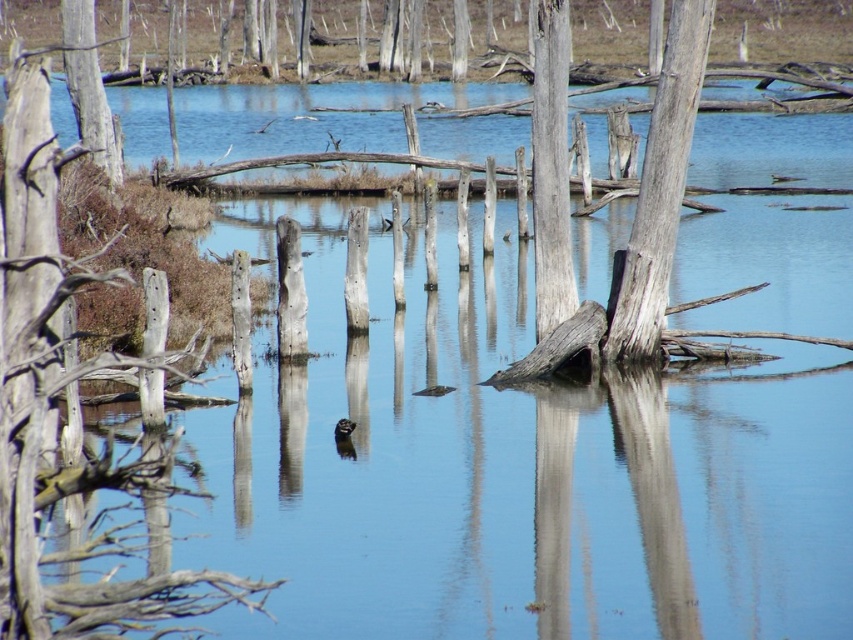
Question: Can you confirm if gray wood tree trunk at center is positioned to the left of smooth gray tree trunk at upper left?

Choices:
 (A) no
 (B) yes

Answer: (A)

Question: Among these points, which one is nearest to the camera?

Choices:
 (A) (65, 52)
 (B) (558, 93)
 (C) (637, 300)

Answer: (B)

Question: Can you confirm if gray wood tree trunk at center is smaller than gray rough wood at center?

Choices:
 (A) no
 (B) yes

Answer: (A)

Question: Which point is closer to the camera?

Choices:
 (A) gray rough wood at center
 (B) smooth gray tree trunk at upper left

Answer: (A)

Question: Is gray rough wood at center to the left of smooth gray tree trunk at upper left from the viewer's perspective?

Choices:
 (A) yes
 (B) no

Answer: (B)

Question: Which object appears closest to the camera in this image?

Choices:
 (A) gray wood tree trunk at center
 (B) smooth gray tree trunk at upper left
 (C) gray rough wood at center

Answer: (C)